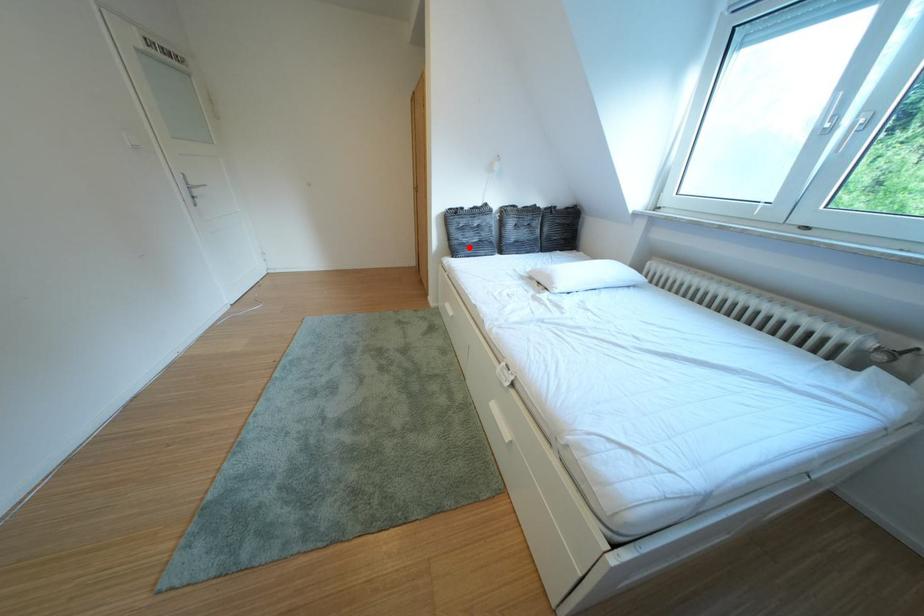
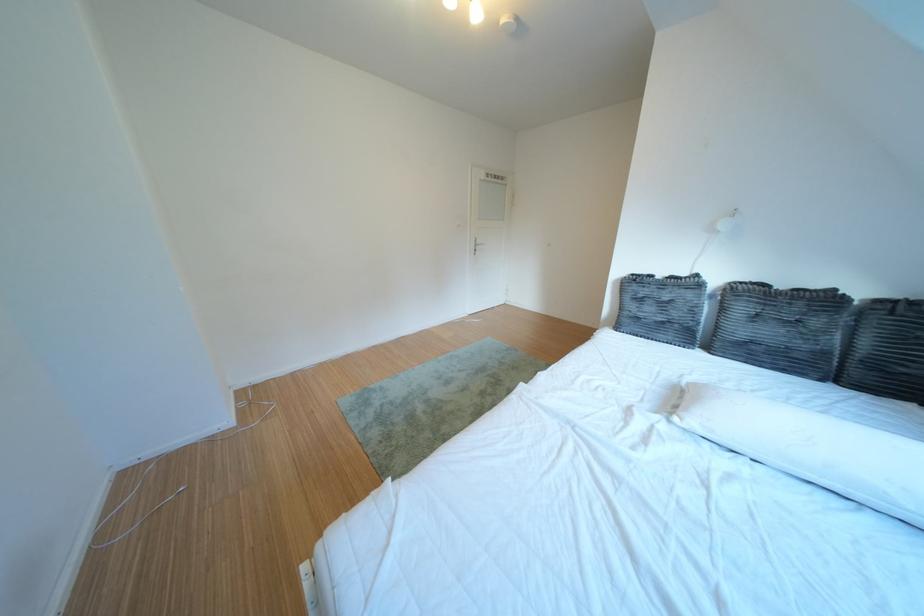
Find the pixel in the second image that matches the highlighted location in the first image.

(639, 318)